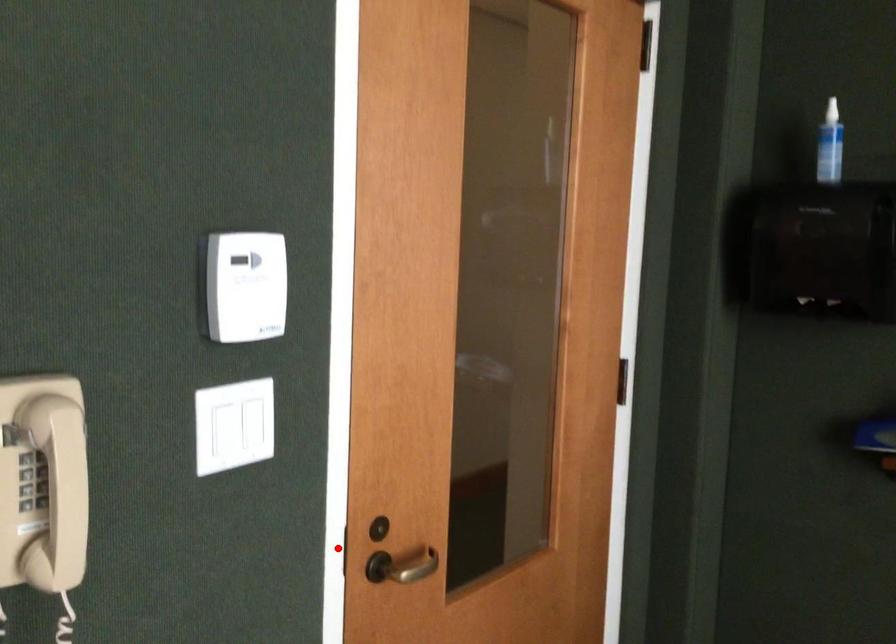
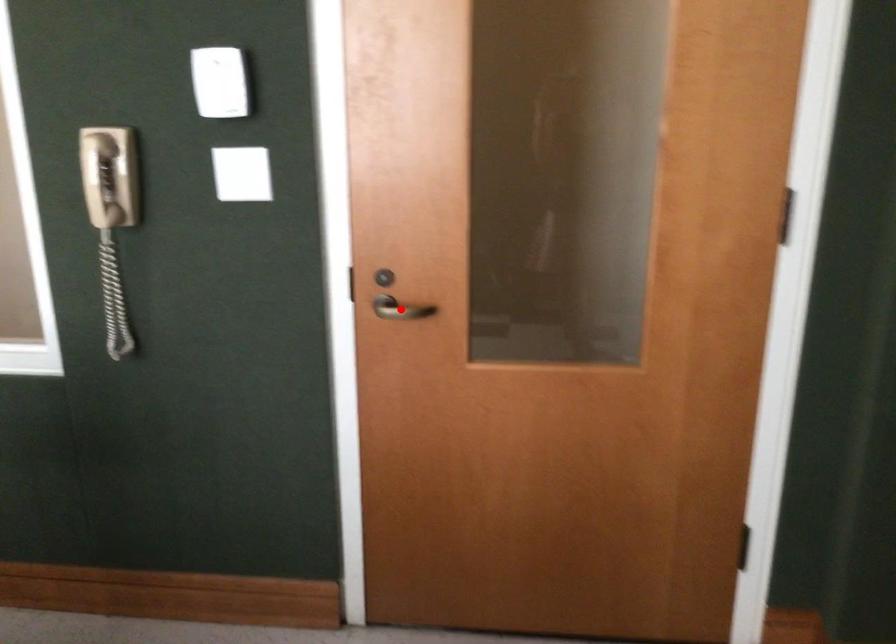
I am providing you with two images of the same scene from different viewpoints. A red point is marked on the first image and another point is marked on the second image. Do the highlighted points in image1 and image2 indicate the same real-world spot?

No